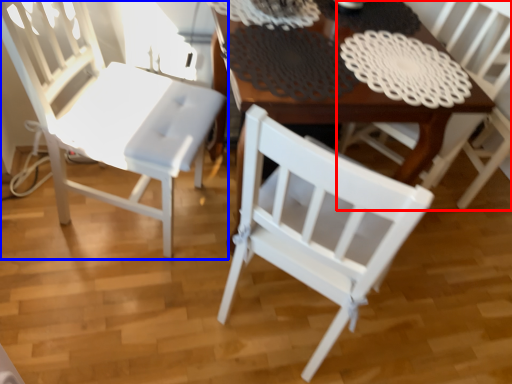
Question: Which point is closer to the camera, chair (highlighted by a red box) or chair (highlighted by a blue box)?

Choices:
 (A) chair
 (B) chair

Answer: (B)